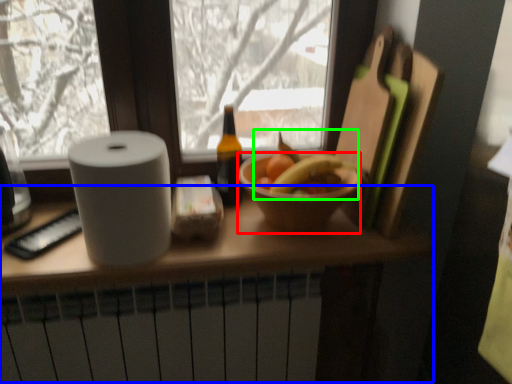
Question: Which object is positioned closest to bowl (highlighted by a red box)? Select from counter (highlighted by a blue box) and fruit (highlighted by a green box).

Choices:
 (A) counter
 (B) fruit

Answer: (B)